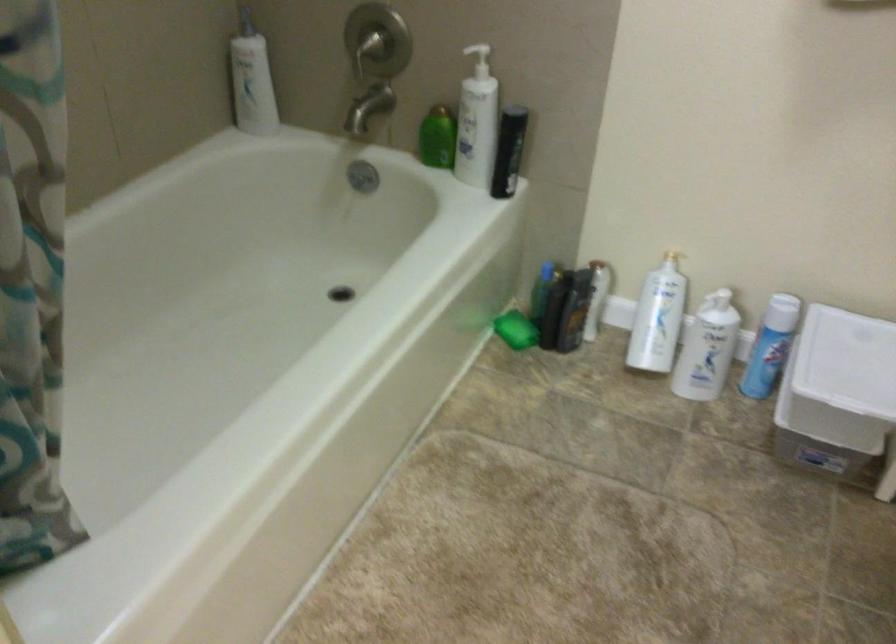
The image size is (896, 644). Describe the element at coordinates (362, 176) in the screenshot. I see `a faucet diverter knob` at that location.